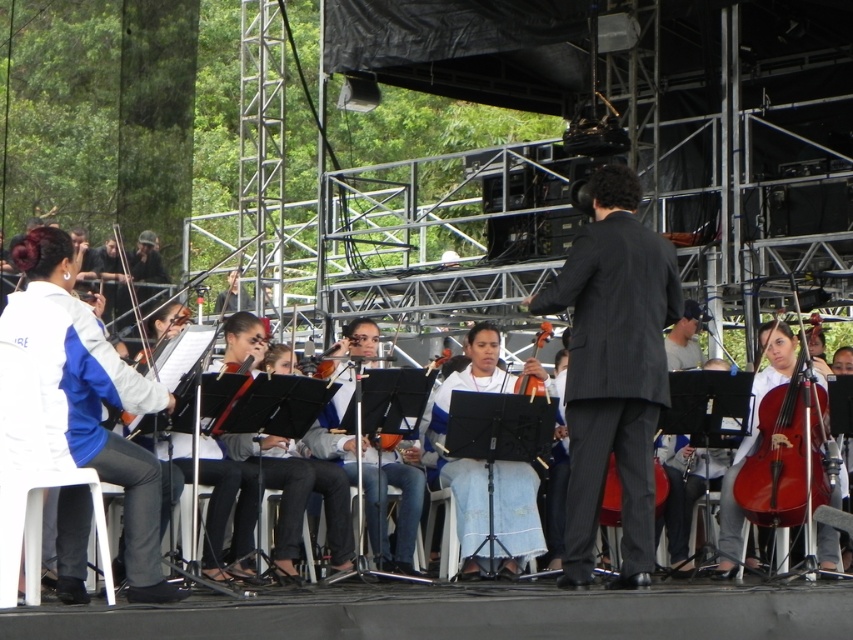
Can you confirm if dark gray pinstripe suit at center is positioned above shiny red wood cello at right?

Yes, dark gray pinstripe suit at center is above shiny red wood cello at right.

Identify the location of dark gray pinstripe suit at center. This screenshot has width=853, height=640. (613, 371).

This screenshot has height=640, width=853. Describe the element at coordinates (531, 385) in the screenshot. I see `matte orange violin at center` at that location.

Looking at this image, how much distance is there between matte orange violin at center and matte black violin at center?

matte orange violin at center and matte black violin at center are 1.72 meters apart from each other.

Locate an element on the screen. matte orange violin at center is located at coordinates (531, 385).

Does shiny red wood cello at right appear over matte orange violin at center?

No, shiny red wood cello at right is not above matte orange violin at center.

Which is in front, point (791, 516) or point (543, 332)?

Positioned in front is point (791, 516).

I want to click on shiny red wood cello at right, so click(x=782, y=452).